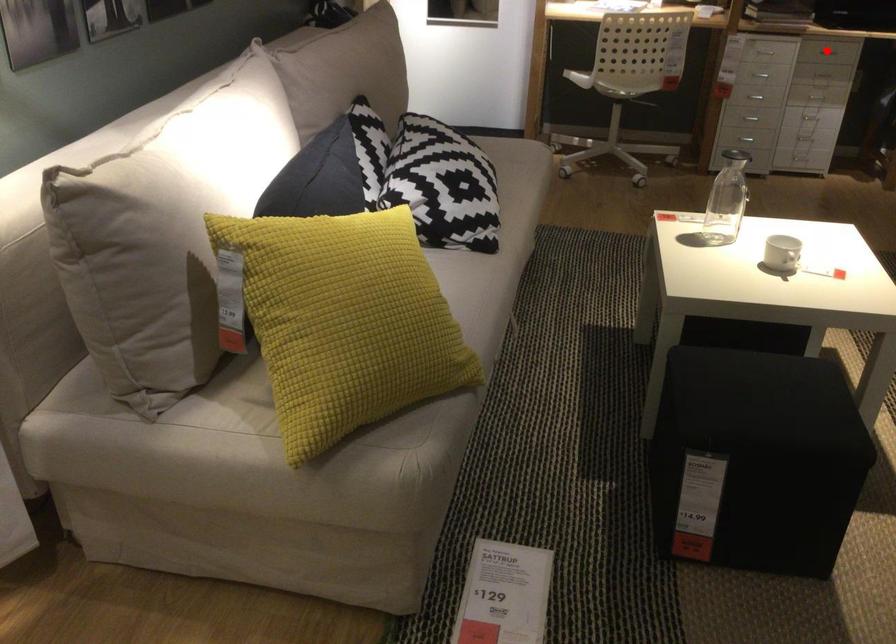
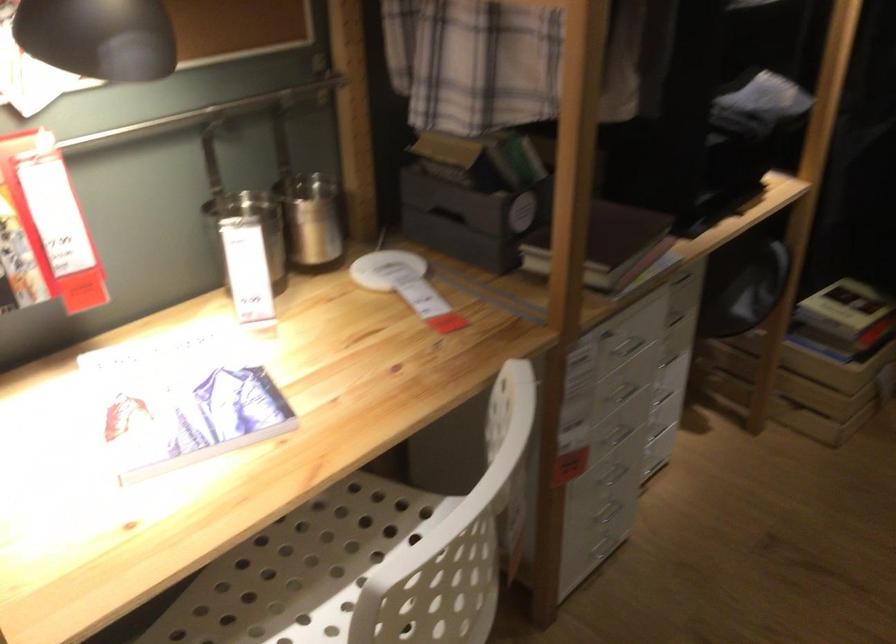
Question: I am providing you with two images of the same scene from different viewpoints. A red point is marked on the first image. Can you still see the location of the red point in image 2?

Choices:
 (A) Yes
 (B) No

Answer: (B)